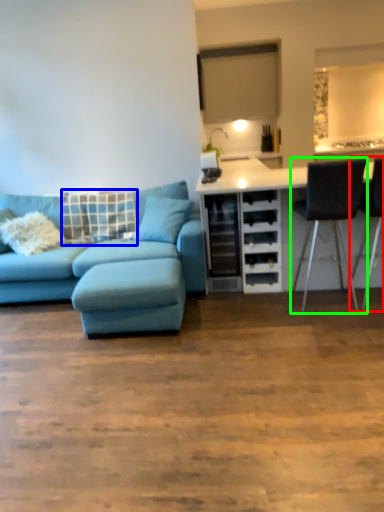
Question: Estimate the real-world distances between objects in this image. Which object is closer to chair (highlighted by a red box), pillow (highlighted by a blue box) or chair (highlighted by a green box)?

Choices:
 (A) pillow
 (B) chair

Answer: (B)